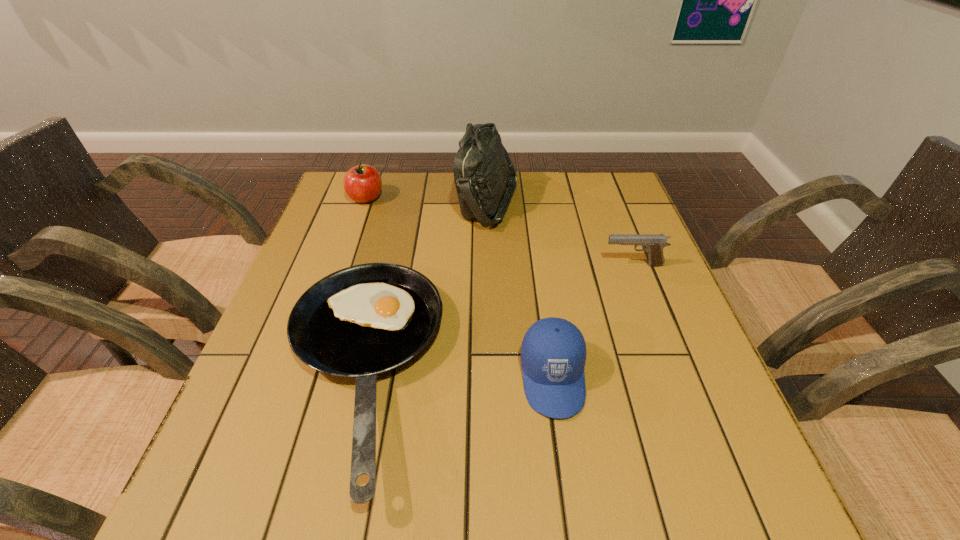
Find the location of a particular element. This screenshot has width=960, height=540. free spot between the frying pan and the pistol is located at coordinates (496, 318).

I want to click on vacant area that lies between the apple and the shoulder bag, so click(x=426, y=200).

You are a GUI agent. You are given a task and a screenshot of the screen. Output one action in this format:
    pyautogui.click(x=<x>, y=<y>)
    Task: Click on the vacant space that is in between the frying pan and the cap
    Image resolution: width=960 pixels, height=540 pixels.
    Given the screenshot: What is the action you would take?
    pyautogui.click(x=456, y=374)

Locate an element on the screen. free space that is in between the shoulder bag and the pistol is located at coordinates (561, 233).

Find the location of a particular element. This screenshot has width=960, height=540. vacant area that lies between the cap and the shortest object is located at coordinates (456, 374).

The height and width of the screenshot is (540, 960). Find the location of `free space between the tallest object and the cap`. free space between the tallest object and the cap is located at coordinates (520, 289).

The image size is (960, 540). Identify the location of free space between the apple and the cap. (459, 288).

Where is `free space between the cap and the shoulder bag`? free space between the cap and the shoulder bag is located at coordinates (520, 289).

Select which object appears as the third closest to the tallest object. Please provide its 2D coordinates. Your answer should be formatted as a tuple, i.e. [(x, y)], where the tuple contains the x and y coordinates of a point satisfying the conditions above.

[(653, 244)]

At what (x,y) coordinates should I click in order to perform the action: click on object that is the second closest to the apple. Please return your answer as a coordinate pair (x, y). This screenshot has height=540, width=960. Looking at the image, I should click on (364, 320).